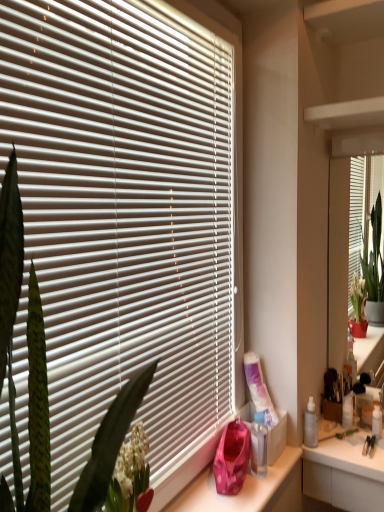
Identify the location of vacant area that lies in front of white plastic bottle at right, which appears as the first toiletry when viewed from the back. tap(354, 449).